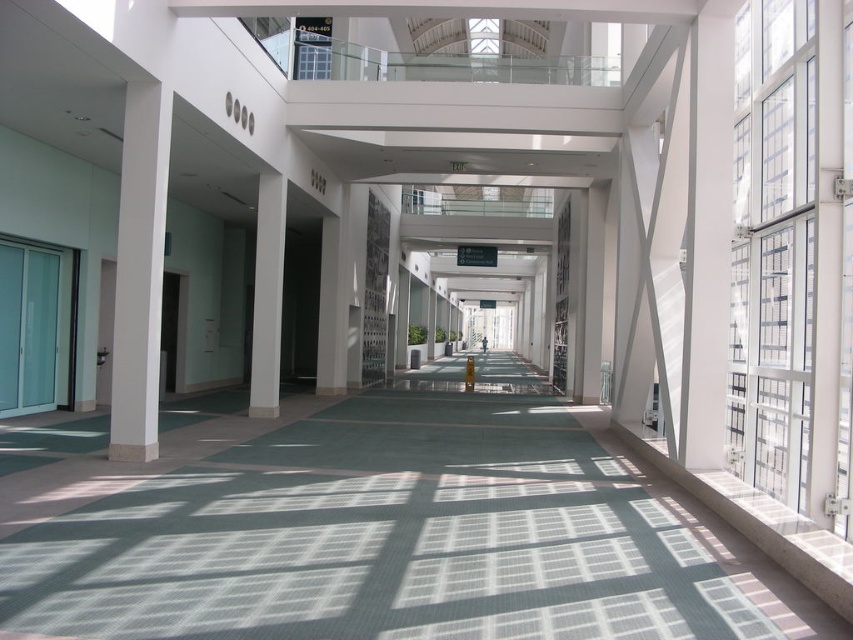
You are a delivery person carrying a 3 meter wide box and need to navigate through the corridor. The corridor has a green carpet at center and a white glossy column at center. Which path should you choose to ensure the box can pass through without hitting anything?

The green carpet at center has a larger width than the white glossy column at center, so you should choose the path along the green carpet at center to ensure the 3 meter wide box can pass through without hitting anything.

You are standing in the corridor and want to move from the entrance on the left to the exit on the right. There are two points marked on the floor at coordinates point (13, 538) and point (258, 355). Which point should you step on first if you want to follow the shortest path towards the exit?

You should step on point (13, 538) first because it is in front of point (258, 355) along your path towards the exit.